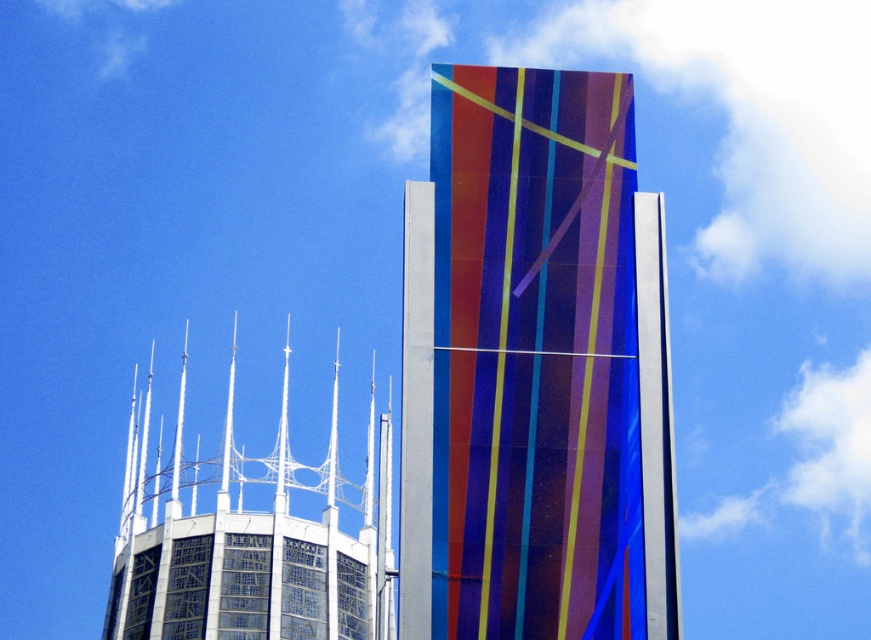
You are a drone operator tasked with flying a drone between the translucent glass tower at center and the white glass spires at upper center. The drone has a maximum flight distance of 40 meters. Can the drone safely fly between them without exceeding its range?

The distance between the translucent glass tower at center and the white glass spires at upper center is 37.32 meters, which is within the drone operator s 40 meter maximum range. The drone can safely fly between them without exceeding its range.

You are an architect analyzing the spatial relationship between the translucent glass tower at center and the white glass spires at upper center. Based on the scene, which structure appears closer to the viewer?

The translucent glass tower at center is closer to the viewer than the white glass spires at upper center according to the spatial arrangement in the scene.